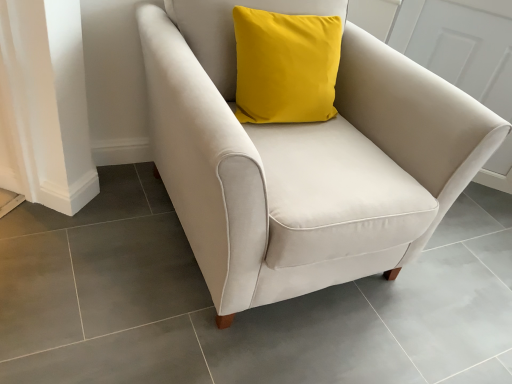
Identify the location of satin white armchair at center. The width and height of the screenshot is (512, 384). pyautogui.click(x=303, y=158).

Describe the element at coordinates (303, 158) in the screenshot. The image size is (512, 384). I see `satin white armchair at center` at that location.

The image size is (512, 384). I want to click on satin white armchair at center, so tap(303, 158).